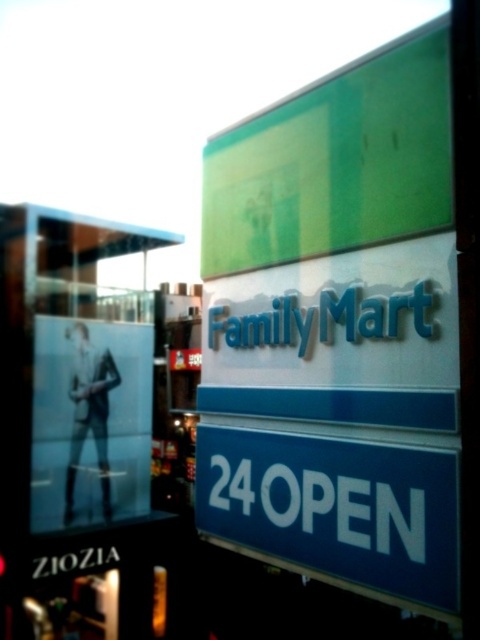
Question: Which point is closer to the camera taking this photo?

Choices:
 (A) (335, 445)
 (B) (79, 304)

Answer: (A)

Question: Does transparent glass window at upper left appear on the right side of blue glossy sign at center?

Choices:
 (A) yes
 (B) no

Answer: (B)

Question: Is transparent glass window at upper left thinner than blue glossy sign at center?

Choices:
 (A) yes
 (B) no

Answer: (B)

Question: Can you confirm if transparent glass window at upper left is thinner than blue glossy sign at center?

Choices:
 (A) no
 (B) yes

Answer: (A)

Question: Which object is farther from the camera taking this photo?

Choices:
 (A) transparent glass window at upper left
 (B) blue glossy sign at center

Answer: (A)